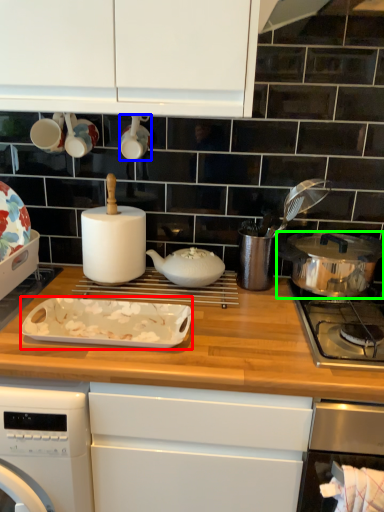
Question: Estimate the real-world distances between objects in this image. Which object is farther from kitchen appliance (highlighted by a red box), appliance (highlighted by a blue box) or kitchen appliance (highlighted by a green box)?

Choices:
 (A) appliance
 (B) kitchen appliance

Answer: (B)